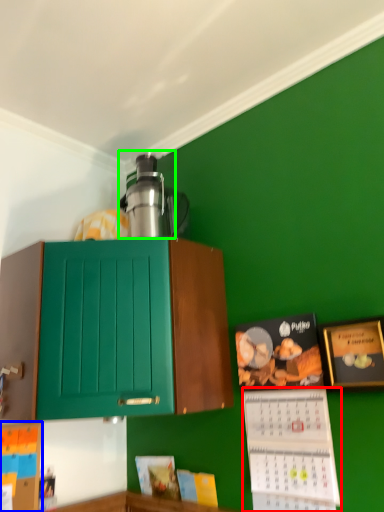
Question: Estimate the real-world distances between objects in this image. Which object is closer to book (highlighted by a red box), book (highlighted by a blue box) or appliance (highlighted by a green box)?

Choices:
 (A) book
 (B) appliance

Answer: (B)